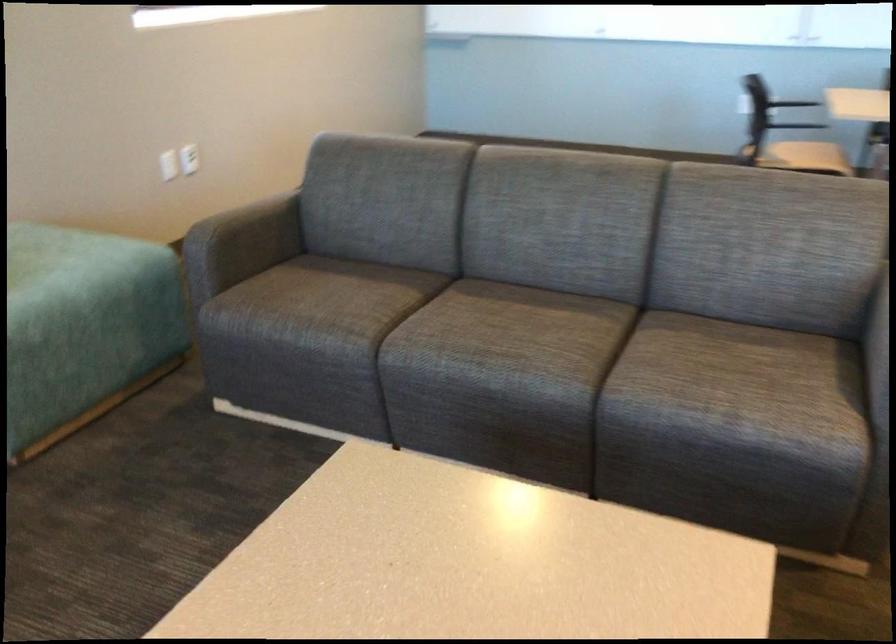
Find where to lean the grey sofa armrest. Please return your answer as a coordinate pair (x, y).

(243, 240)